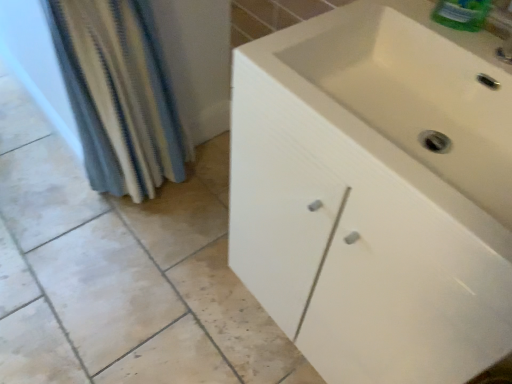
Locate an element on the screen. free region under blue striped fabric at left (from a real-world perspective) is located at coordinates (139, 204).